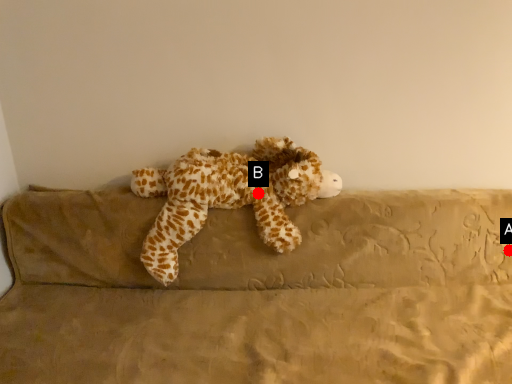
Question: Two points are circled on the image, labeled by A and B beside each circle. Which point is further to the camera?

Choices:
 (A) A is further
 (B) B is further

Answer: (A)